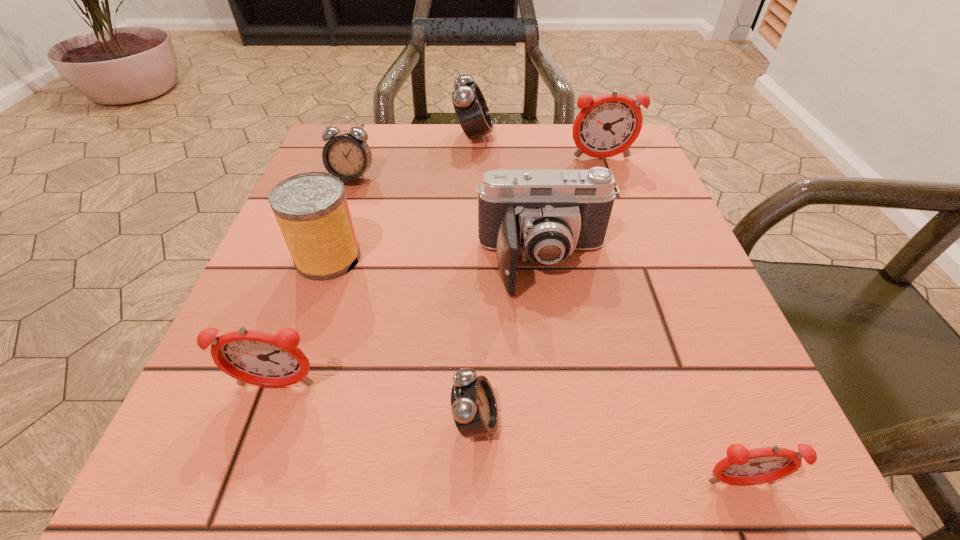
Where is `the smallest white alarm clock`? the smallest white alarm clock is located at coordinates (474, 408).

This screenshot has height=540, width=960. What are the coordinates of `the seventh farthest object` in the screenshot? It's located at (474, 408).

Locate an element on the screen. This screenshot has width=960, height=540. the nearest reddish-pink alarm clock is located at coordinates (741, 466).

Locate an element on the screen. the nearest object is located at coordinates (741, 466).

Image resolution: width=960 pixels, height=540 pixels. I want to click on vacant space located on the face of the farthest alarm clock, so click(x=523, y=137).

Find the location of a particular element. The image size is (960, 540). vacant region located 0.230m on the front-facing side of the seventh nearest object is located at coordinates [627, 231].

Find the location of a particular element. This screenshot has width=960, height=540. free location located 0.150m at the front of the camera with an open lens cover is located at coordinates (561, 388).

This screenshot has width=960, height=540. What are the coordinates of `vacant space located 0.260m on the front of the can` in the screenshot? It's located at [266, 437].

You are a GUI agent. You are given a task and a screenshot of the screen. Output one action in this format:
    pyautogui.click(x=<x>, y=<y>)
    Task: Click on the vacant space located on the front-facing side of the second farthest reddish-pink alarm clock
    Image resolution: width=960 pixels, height=540 pixels.
    Given the screenshot: What is the action you would take?
    pyautogui.click(x=238, y=493)

The image size is (960, 540). Find the location of `free space located on the face of the leftmost white alarm clock`. free space located on the face of the leftmost white alarm clock is located at coordinates (339, 216).